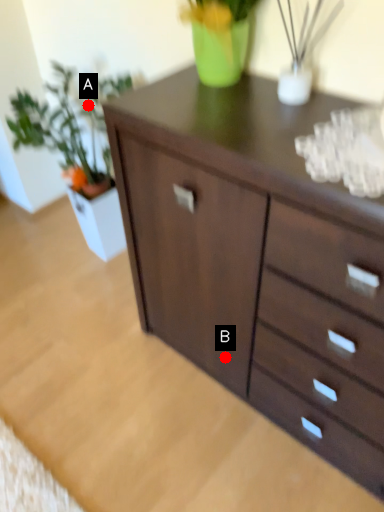
Question: Two points are circled on the image, labeled by A and B beside each circle. Among these points, which one is farthest from the camera?

Choices:
 (A) A is further
 (B) B is further

Answer: (A)